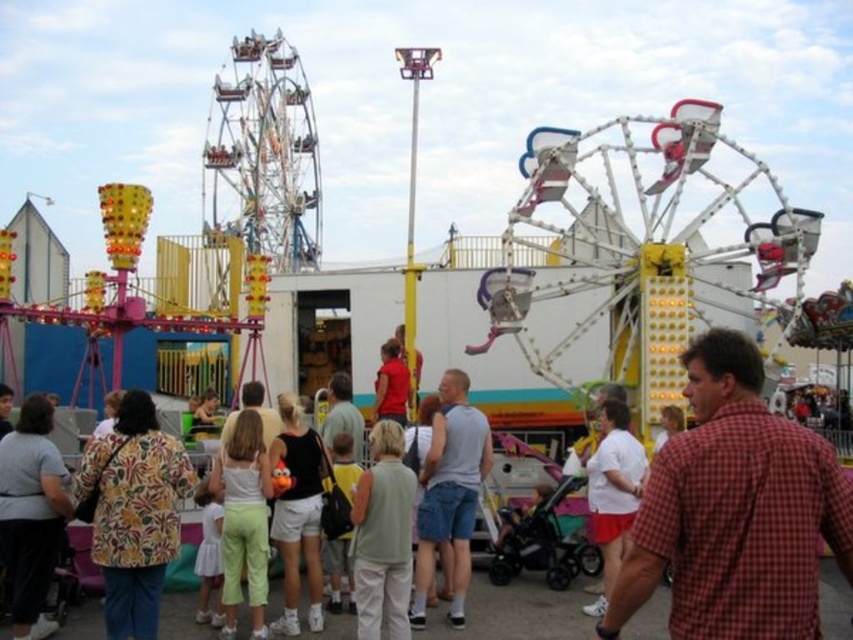
Is point (126, 588) positioned behind point (524, 616)?

No, it is not.

Which is below, floral print shirt at center or light beige shorts at center?

Positioned lower is light beige shorts at center.

Image resolution: width=853 pixels, height=640 pixels. Identify the location of floral print shirt at center. (134, 513).

Where is `floral print shirt at center`? floral print shirt at center is located at coordinates (134, 513).

Is point (729, 458) positioned behind point (468, 540)?

No, it is in front of (468, 540).

Which is behind, point (698, 474) or point (440, 484)?

Point (440, 484)

In order to click on red checkered shirt at center in this screenshot , I will do `click(734, 509)`.

Is point (28, 429) positioned behind point (379, 442)?

No.

Is floral print blouse at lower left shorter than light green fabric shirt at center?

No, floral print blouse at lower left is not shorter than light green fabric shirt at center.

Find the location of a particular element. This screenshot has width=853, height=640. floral print blouse at lower left is located at coordinates (32, 515).